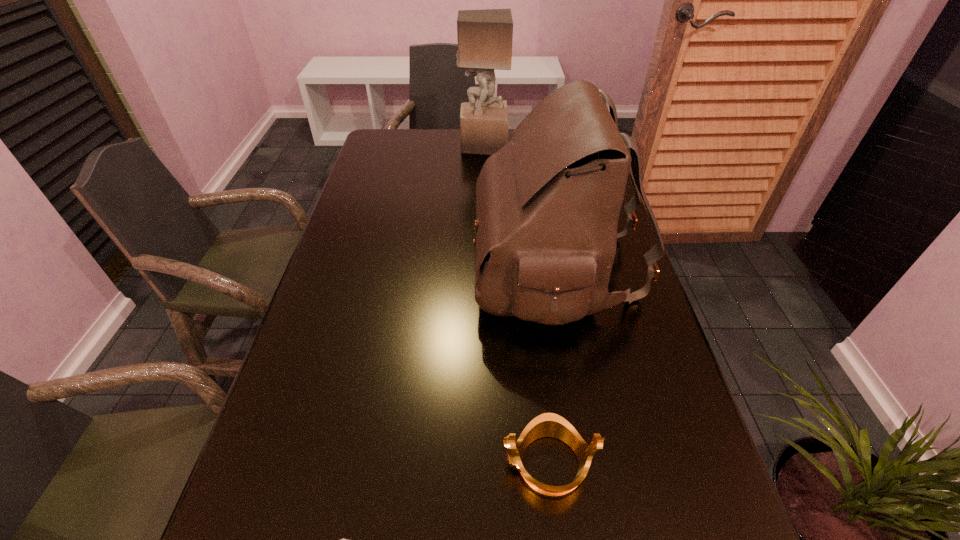
Where is `vacant position at the far edge of the desktop`? vacant position at the far edge of the desktop is located at coordinates (420, 156).

Where is `free space at the left edge`? Image resolution: width=960 pixels, height=540 pixels. free space at the left edge is located at coordinates (341, 410).

The height and width of the screenshot is (540, 960). In the image, there is a desktop. In order to click on vacant space at the right edge in this screenshot , I will do `click(607, 354)`.

The image size is (960, 540). In order to click on vacant space that is in between the satchel and the tiara in this screenshot , I will do pyautogui.click(x=552, y=365).

The image size is (960, 540). I want to click on object that can be found as the closest to the satchel, so click(599, 90).

I want to click on object that is the second closest to the farthest object, so click(x=547, y=203).

The image size is (960, 540). What are the coordinates of `vacant space that satisfies the following two spatial constraints: 1. on the front side of the fourth nearest object; 2. at the front emblem of the fourth farthest object` in the screenshot? It's located at pyautogui.click(x=673, y=463).